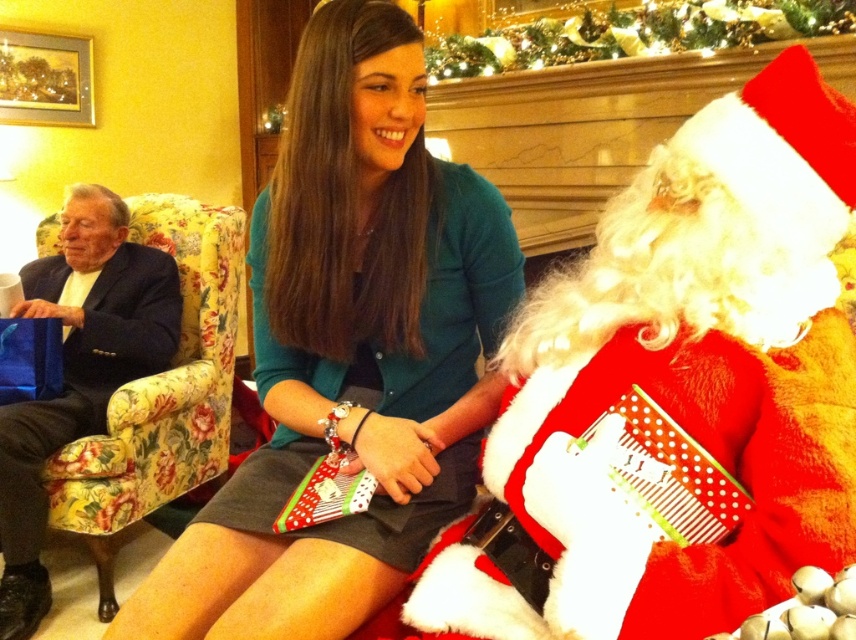
Question: Which point appears farthest from the camera in this image?

Choices:
 (A) (105, 456)
 (B) (744, 29)

Answer: (B)

Question: Which of these objects is positioned closest to the red velvet santa at center?

Choices:
 (A) teal sweater at center
 (B) floral fabric armchair at left

Answer: (A)

Question: Estimate the real-world distances between objects in this image. Which object is farther from the floral fabric armchair at left?

Choices:
 (A) red velvet santa at center
 (B) shiny gold ornaments at upper center
 (C) teal sweater at center

Answer: (B)

Question: Does red velvet santa at center appear on the left side of teal sweater at center?

Choices:
 (A) yes
 (B) no

Answer: (B)

Question: Can you confirm if red velvet santa at center is bigger than shiny gold ornaments at upper center?

Choices:
 (A) yes
 (B) no

Answer: (B)

Question: Does red velvet santa at center appear over floral fabric armchair at left?

Choices:
 (A) yes
 (B) no

Answer: (A)